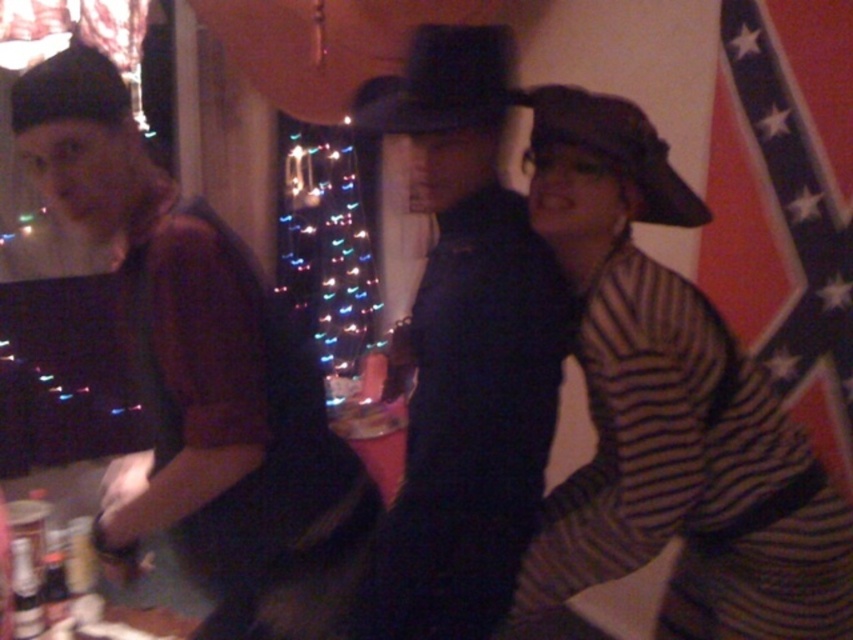
Is point (204, 266) behind point (323, 355)?

That is False.

Describe the element at coordinates (199, 372) in the screenshot. I see `matte black shirt at left` at that location.

Find the location of a particular element. This screenshot has width=853, height=640. matte black shirt at left is located at coordinates (199, 372).

Between matte black shirt at left and black felt cowboy hat at center, which one appears on the left side from the viewer's perspective?

matte black shirt at left is more to the left.

Who is more distant from viewer, (216, 538) or (374, 100)?

Positioned behind is point (374, 100).

Who is more distant from viewer, (190, 294) or (468, 54)?

The point (468, 54) is behind.

At what (x,y) coordinates should I click in order to perform the action: click on matte black shirt at left. Please return your answer as a coordinate pair (x, y). The image size is (853, 640). Looking at the image, I should click on (199, 372).

This screenshot has width=853, height=640. I want to click on black felt cowboy hat at center, so click(x=444, y=83).

Can you confirm if black felt cowboy hat at center is positioned below metallic can at center?

Incorrect, black felt cowboy hat at center is not positioned below metallic can at center.

Describe the element at coordinates (444, 83) in the screenshot. Image resolution: width=853 pixels, height=640 pixels. I see `black felt cowboy hat at center` at that location.

At what (x,y) coordinates should I click in order to perform the action: click on black felt cowboy hat at center. Please return your answer as a coordinate pair (x, y). Image resolution: width=853 pixels, height=640 pixels. Looking at the image, I should click on (444, 83).